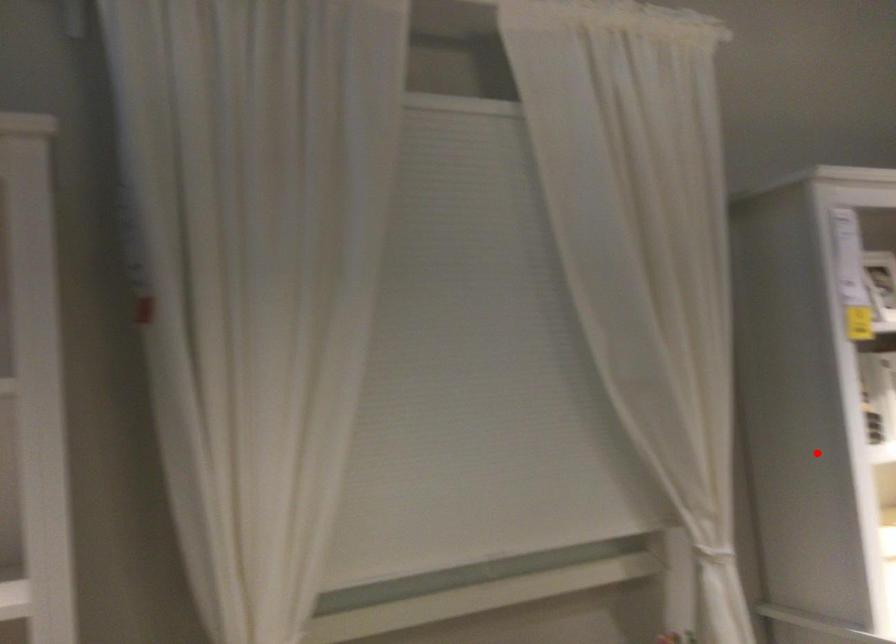
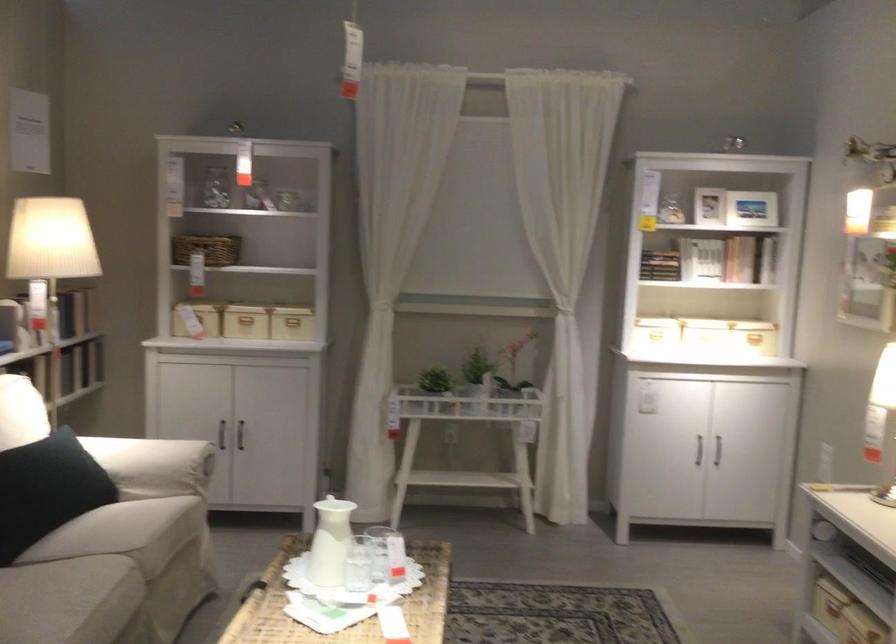
The point at the highlighted location is marked in the first image. Where is the corresponding point in the second image?

(659, 265)